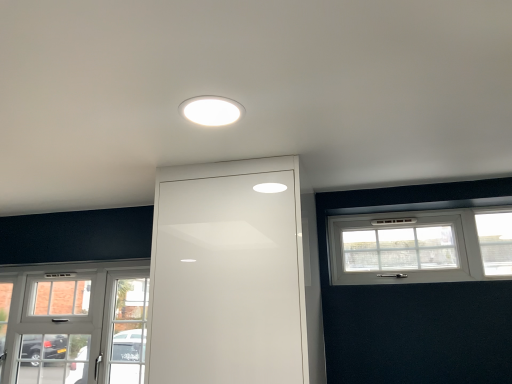
Question: Is white glossy door at center at the right side of white glossy light fixture at center?

Choices:
 (A) no
 (B) yes

Answer: (B)

Question: From the image's perspective, would you say white glossy door at center is positioned over white glossy light fixture at center?

Choices:
 (A) yes
 (B) no

Answer: (B)

Question: Is white glossy door at center not inside white glossy light fixture at center?

Choices:
 (A) no
 (B) yes

Answer: (B)

Question: Considering the relative sizes of white glossy door at center and white glossy light fixture at center in the image provided, is white glossy door at center thinner than white glossy light fixture at center?

Choices:
 (A) no
 (B) yes

Answer: (A)

Question: Does white glossy door at center appear on the left side of white glossy light fixture at center?

Choices:
 (A) yes
 (B) no

Answer: (B)

Question: Is white glossy light fixture at center situated inside white glass door at lower left, acting as the 2th window starting from the front, or outside?

Choices:
 (A) outside
 (B) inside

Answer: (A)

Question: Considering the positions of white glossy light fixture at center and white glass door at lower left, placed as the first window when sorted from left to right, in the image, is white glossy light fixture at center taller or shorter than white glass door at lower left, placed as the first window when sorted from left to right,?

Choices:
 (A) short
 (B) tall

Answer: (A)

Question: From the image's perspective, is white glossy light fixture at center located above or below white glass door at lower left, arranged as the second window when viewed from the right?

Choices:
 (A) above
 (B) below

Answer: (A)

Question: Based on their positions, is white glossy light fixture at center located to the left or right of white glass door at lower left, arranged as the second window when viewed from the right?

Choices:
 (A) left
 (B) right

Answer: (B)

Question: From the image's perspective, is white glossy light fixture at center located above or below white glossy door at center?

Choices:
 (A) below
 (B) above

Answer: (B)

Question: In terms of width, does white glossy light fixture at center look wider or thinner when compared to white glossy door at center?

Choices:
 (A) wide
 (B) thin

Answer: (B)

Question: In terms of size, does white glossy light fixture at center appear bigger or smaller than white glossy door at center?

Choices:
 (A) small
 (B) big

Answer: (A)

Question: In the image, is white glossy light fixture at center positioned in front of or behind white glossy door at center?

Choices:
 (A) front
 (B) behind

Answer: (A)

Question: Which is correct: white textured window at upper right, placed as the 1th window when sorted from front to back, is inside white glass door at lower left, marked as the 1th window in a bottom-to-top arrangement, or outside of it?

Choices:
 (A) inside
 (B) outside

Answer: (B)

Question: From a real-world perspective, is white textured window at upper right, marked as the 2th window in a left-to-right arrangement, physically located above or below white glass door at lower left, which is the 2th window from top to bottom?

Choices:
 (A) below
 (B) above

Answer: (B)